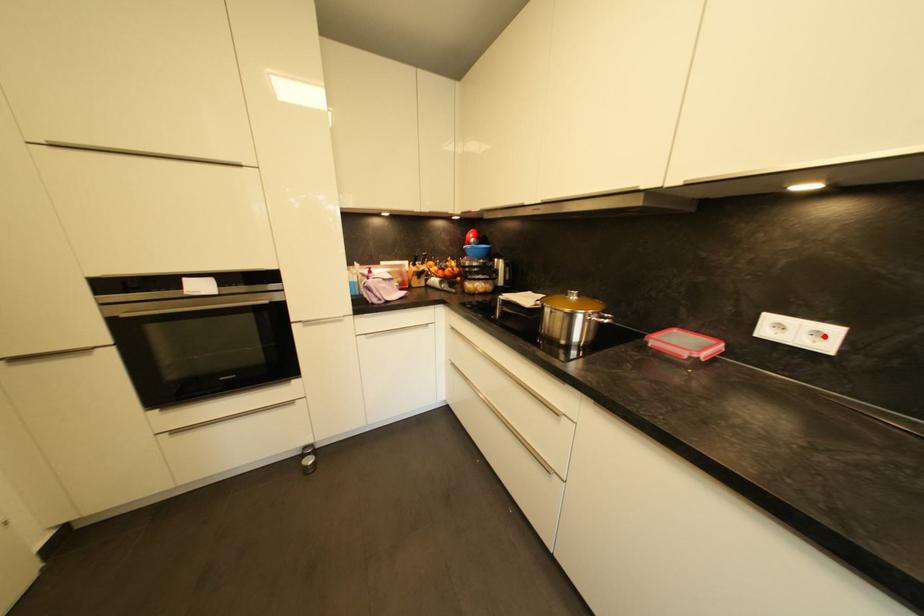
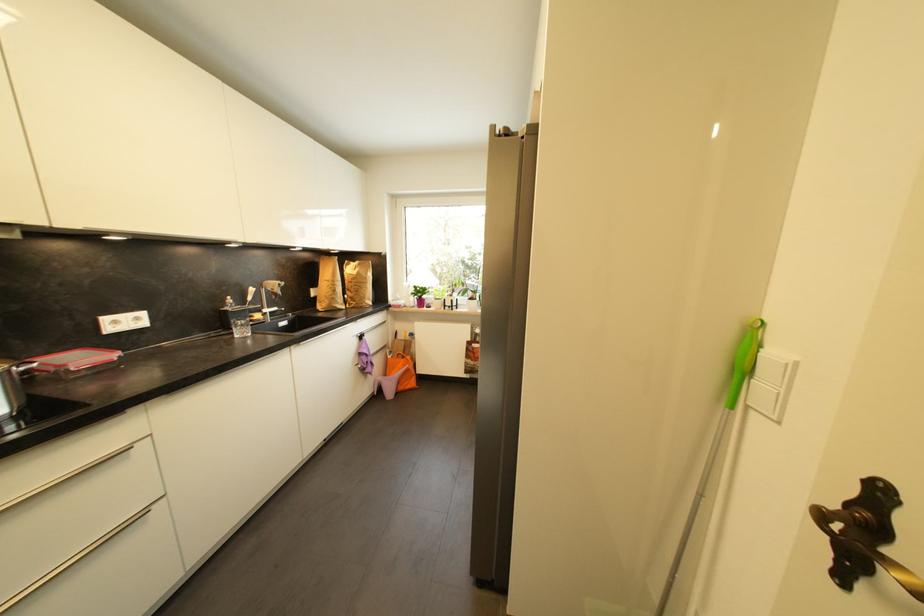
Find the pixel in the second image that matches the highlighted location in the first image.

(142, 321)